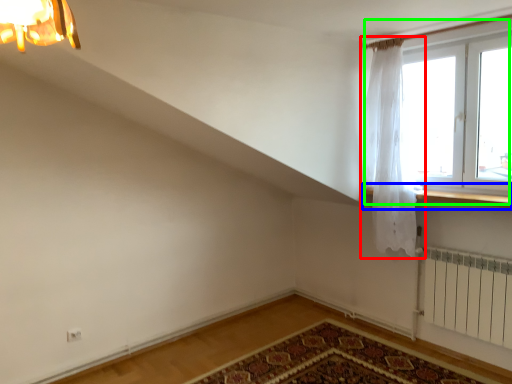
Question: Which object is positioned farthest from curtain (highlighted by a red box)? Select from window sill (highlighted by a blue box) and window (highlighted by a green box).

Choices:
 (A) window sill
 (B) window

Answer: (A)